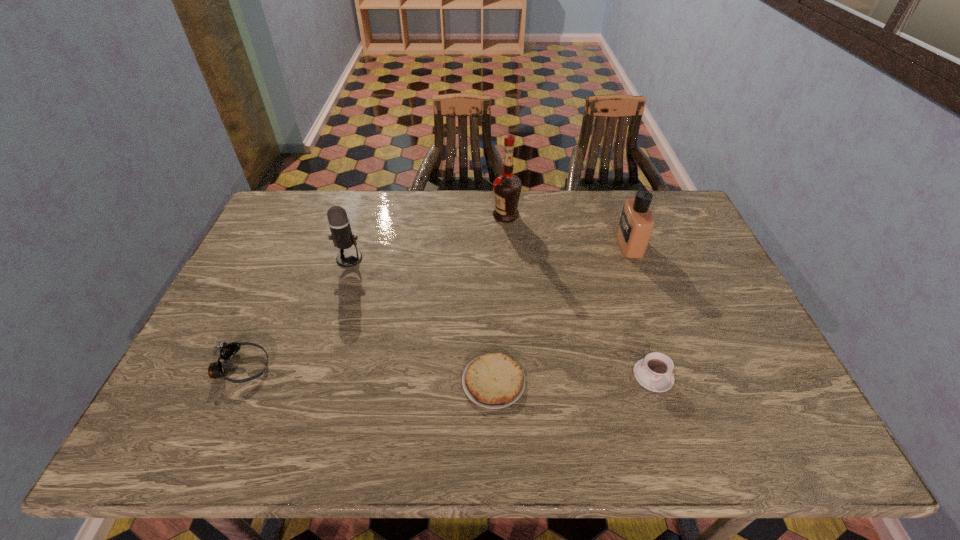
The image size is (960, 540). I want to click on vacant area situated on the right of the microphone, so click(486, 259).

This screenshot has width=960, height=540. What are the coordinates of `vacant space located on the front label of the perfume` in the screenshot? It's located at (526, 244).

Identify the location of vacant space located 0.250m on the front label of the perfume. (541, 244).

At what (x,y) coordinates should I click in order to perform the action: click on vacant space located 0.060m on the front label of the perfume. Please return your answer as a coordinate pair (x, y). The height and width of the screenshot is (540, 960). Looking at the image, I should click on (600, 244).

Where is `blank area located 0.260m on the handle side of the teacup`? blank area located 0.260m on the handle side of the teacup is located at coordinates (527, 375).

Find the location of a particular element. vacant space located on the handle side of the teacup is located at coordinates pyautogui.click(x=519, y=375).

Where is `vacant space located 0.290m on the handle side of the teacup`? vacant space located 0.290m on the handle side of the teacup is located at coordinates [515, 375].

The width and height of the screenshot is (960, 540). Identify the location of vacant space situated 0.130m through the lenses of the leftmost object. (322, 367).

The height and width of the screenshot is (540, 960). What are the coordinates of `free space located on the back of the tortilla` in the screenshot? It's located at (492, 297).

You are a GUI agent. You are given a task and a screenshot of the screen. Output one action in this format:
    pyautogui.click(x=<x>, y=<y>)
    Task: Click on the liquor that is at the far edge
    
    Given the screenshot: What is the action you would take?
    [x=507, y=187]